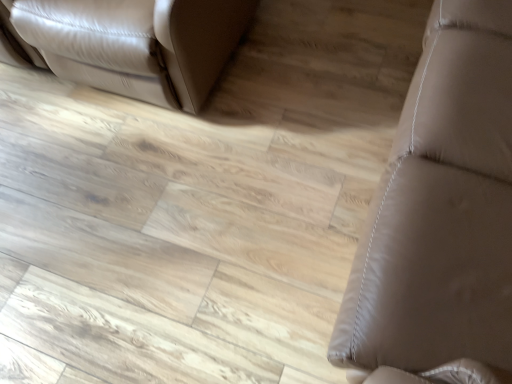
What do you see at coordinates (441, 218) in the screenshot? The width and height of the screenshot is (512, 384). I see `brown leather couch at right, which is the 1th furniture from right to left` at bounding box center [441, 218].

Identify the location of brown leather couch at right, the second furniture from the left. (441, 218).

Measure the distance between brown leather couch at right, the second furniture from the left, and camera.

brown leather couch at right, the second furniture from the left, is 27.06 inches from camera.

What is the approximate width of matte leather couch at upper left, the first furniture in the left-to-right sequence?

36.56 inches.

Describe the element at coordinates (134, 43) in the screenshot. I see `matte leather couch at upper left, the first furniture in the left-to-right sequence` at that location.

Where is `matte leather couch at upper left, which is counted as the 2th furniture, starting from the right`? This screenshot has height=384, width=512. matte leather couch at upper left, which is counted as the 2th furniture, starting from the right is located at coordinates (134, 43).

Locate an element on the screen. The height and width of the screenshot is (384, 512). brown leather couch at right, the second furniture from the left is located at coordinates (441, 218).

Is brown leather couch at right, the second furniture from the left, at the right side of matte leather couch at upper left, the first furniture in the left-to-right sequence?

Yes.

Considering their positions, is brown leather couch at right, which is the 1th furniture from right to left, located in front of or behind matte leather couch at upper left, the first furniture in the left-to-right sequence?

Visually, brown leather couch at right, which is the 1th furniture from right to left, is located in front of matte leather couch at upper left, the first furniture in the left-to-right sequence.

Is point (386, 368) positioned behind point (170, 17)?

No, it is not.

Consider the image. From the image's perspective, is brown leather couch at right, which is the 1th furniture from right to left, on top of matte leather couch at upper left, which is counted as the 2th furniture, starting from the right?

No, from the image's perspective, brown leather couch at right, which is the 1th furniture from right to left, is not above matte leather couch at upper left, which is counted as the 2th furniture, starting from the right.

From a real-world perspective, between brown leather couch at right, the second furniture from the left, and matte leather couch at upper left, which is counted as the 2th furniture, starting from the right, who is vertically lower?

matte leather couch at upper left, which is counted as the 2th furniture, starting from the right, is physically lower.

Can you confirm if brown leather couch at right, the second furniture from the left, is thinner than matte leather couch at upper left, which is counted as the 2th furniture, starting from the right?

Correct, the width of brown leather couch at right, the second furniture from the left, is less than that of matte leather couch at upper left, which is counted as the 2th furniture, starting from the right.

Considering the sizes of brown leather couch at right, which is the 1th furniture from right to left, and matte leather couch at upper left, the first furniture in the left-to-right sequence, in the image, is brown leather couch at right, which is the 1th furniture from right to left, taller or shorter than matte leather couch at upper left, the first furniture in the left-to-right sequence,?

Considering their sizes, brown leather couch at right, which is the 1th furniture from right to left, has more height than matte leather couch at upper left, the first furniture in the left-to-right sequence.

Does brown leather couch at right, which is the 1th furniture from right to left, have a larger size compared to matte leather couch at upper left, which is counted as the 2th furniture, starting from the right?

Indeed, brown leather couch at right, which is the 1th furniture from right to left, has a larger size compared to matte leather couch at upper left, which is counted as the 2th furniture, starting from the right.

Do you think brown leather couch at right, which is the 1th furniture from right to left, is within matte leather couch at upper left, which is counted as the 2th furniture, starting from the right, or outside of it?

brown leather couch at right, which is the 1th furniture from right to left, is not enclosed by matte leather couch at upper left, which is counted as the 2th furniture, starting from the right.

Is brown leather couch at right, the second furniture from the left, placed right next to matte leather couch at upper left, which is counted as the 2th furniture, starting from the right?

They are not placed beside each other.

Is brown leather couch at right, which is the 1th furniture from right to left, positioned with its back to matte leather couch at upper left, the first furniture in the left-to-right sequence?

No.

In the scene shown: What's the angular difference between brown leather couch at right, the second furniture from the left, and matte leather couch at upper left, which is counted as the 2th furniture, starting from the right,'s facing directions?

They differ by 91.4 degrees in their facing directions.

You are a GUI agent. You are given a task and a screenshot of the screen. Output one action in this format:
    pyautogui.click(x=<x>, y=<y>)
    Task: Click on the furniture positioned vertically above the matte leather couch at upper left, the first furniture in the left-to-right sequence (from a real-world perspective)
    This screenshot has height=384, width=512.
    Given the screenshot: What is the action you would take?
    pyautogui.click(x=441, y=218)

Based on their positions, is matte leather couch at upper left, which is counted as the 2th furniture, starting from the right, located to the left or right of brown leather couch at right, the second furniture from the left?

Based on their positions, matte leather couch at upper left, which is counted as the 2th furniture, starting from the right, is located to the left of brown leather couch at right, the second furniture from the left.

Which object is closer to the camera, matte leather couch at upper left, which is counted as the 2th furniture, starting from the right, or brown leather couch at right, which is the 1th furniture from right to left?

Positioned in front is brown leather couch at right, which is the 1th furniture from right to left.

Between point (63, 51) and point (357, 274), which one is positioned in front?

Positioned in front is point (357, 274).

From the image's perspective, is matte leather couch at upper left, which is counted as the 2th furniture, starting from the right, beneath brown leather couch at right, which is the 1th furniture from right to left?

Incorrect, from the image's perspective, matte leather couch at upper left, which is counted as the 2th furniture, starting from the right, is higher than brown leather couch at right, which is the 1th furniture from right to left.

From a real-world perspective, is matte leather couch at upper left, the first furniture in the left-to-right sequence, under brown leather couch at right, the second furniture from the left?

Correct, in the physical world, matte leather couch at upper left, the first furniture in the left-to-right sequence, is lower than brown leather couch at right, the second furniture from the left.

Can you confirm if matte leather couch at upper left, which is counted as the 2th furniture, starting from the right, is wider than brown leather couch at right, which is the 1th furniture from right to left?

Correct, the width of matte leather couch at upper left, which is counted as the 2th furniture, starting from the right, exceeds that of brown leather couch at right, which is the 1th furniture from right to left.

In terms of height, does matte leather couch at upper left, which is counted as the 2th furniture, starting from the right, look taller or shorter compared to brown leather couch at right, which is the 1th furniture from right to left?

In the image, matte leather couch at upper left, which is counted as the 2th furniture, starting from the right, appears to be shorter than brown leather couch at right, which is the 1th furniture from right to left.

Considering the relative sizes of matte leather couch at upper left, the first furniture in the left-to-right sequence, and brown leather couch at right, which is the 1th furniture from right to left, in the image provided, is matte leather couch at upper left, the first furniture in the left-to-right sequence, bigger than brown leather couch at right, which is the 1th furniture from right to left,?

No.

Would you say matte leather couch at upper left, the first furniture in the left-to-right sequence, is inside or outside brown leather couch at right, the second furniture from the left?

matte leather couch at upper left, the first furniture in the left-to-right sequence, cannot be found inside brown leather couch at right, the second furniture from the left.

Is matte leather couch at upper left, the first furniture in the left-to-right sequence, far away from brown leather couch at right, the second furniture from the left?

They are positioned close to each other.

Is matte leather couch at upper left, which is counted as the 2th furniture, starting from the right, looking in the opposite direction of brown leather couch at right, which is the 1th furniture from right to left?

That's not correct — matte leather couch at upper left, which is counted as the 2th furniture, starting from the right, is not looking away from brown leather couch at right, which is the 1th furniture from right to left.

What's the angular difference between matte leather couch at upper left, the first furniture in the left-to-right sequence, and brown leather couch at right, the second furniture from the left,'s facing directions?

They differ by 91.4 degrees in their facing directions.

Could you measure the distance between matte leather couch at upper left, which is counted as the 2th furniture, starting from the right, and brown leather couch at right, the second furniture from the left?

matte leather couch at upper left, which is counted as the 2th furniture, starting from the right, and brown leather couch at right, the second furniture from the left, are 35.69 inches apart from each other.

Locate an element on the screen. This screenshot has width=512, height=384. furniture that appears on the left of brown leather couch at right, the second furniture from the left is located at coordinates (134, 43).

Where is `furniture below the brown leather couch at right, which is the 1th furniture from right to left (from a real-world perspective)`? furniture below the brown leather couch at right, which is the 1th furniture from right to left (from a real-world perspective) is located at coordinates (134, 43).

Image resolution: width=512 pixels, height=384 pixels. What are the coordinates of `furniture that appears on the right of matte leather couch at upper left, which is counted as the 2th furniture, starting from the right` in the screenshot? It's located at (441, 218).